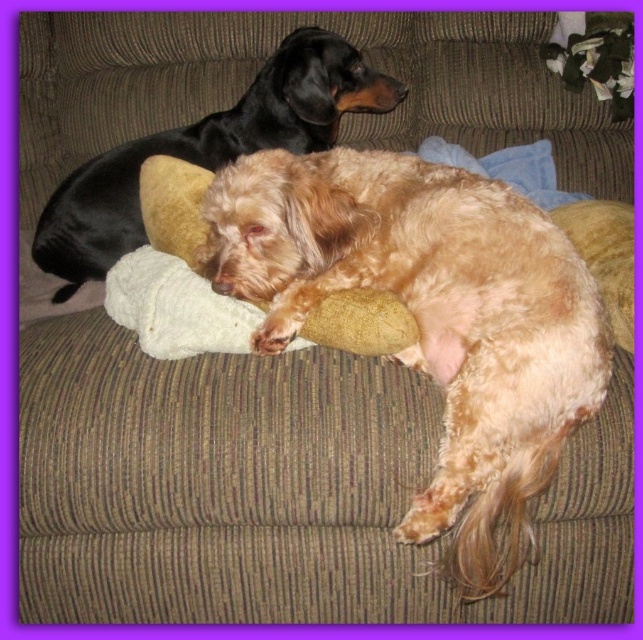
You are a dog owner who wants to place a new dog bed in the living room. The bed is designed to fit dogs with a width of at least 30 cm. Based on the image, which dog, the fuzzy golden dog at center or the shiny black dog at upper left, is more likely to need a larger bed?

The shiny black dog at upper left has a greater width compared to the fuzzy golden dog at center, so it is more likely to need a larger bed.

You are a photographer trying to capture both dogs in a single shot. Since the fuzzy golden dog at center is blocking part of the shiny black dog at upper left, which direction should you move your camera to ensure both are fully visible?

To ensure both the fuzzy golden dog at center and the shiny black dog at upper left are fully visible, move the camera to the left. This adjustment will shift the perspective so that the fuzzy golden dog at center, which is currently to the right of the shiny black dog at upper left, no longer blocks the view of the latter.